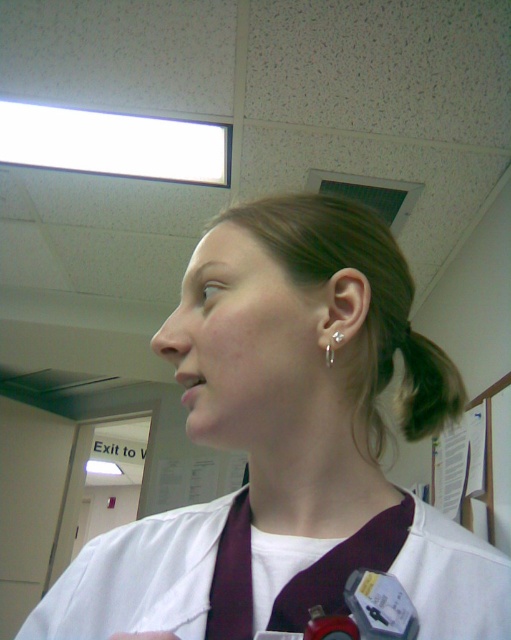
Is white fabric at center behind white matte lab coat at center?

No, white fabric at center is closer to the viewer.

Does white fabric at center have a greater width compared to white matte lab coat at center?

Correct, the width of white fabric at center exceeds that of white matte lab coat at center.

Between point (251, 458) and point (509, 589), which one is positioned behind?

Point (251, 458)

Locate an element on the screen. Image resolution: width=511 pixels, height=640 pixels. white fabric at center is located at coordinates tap(283, 449).

Which is in front, point (420, 412) or point (460, 636)?

Point (460, 636) is in front.

Is dark brown hair at upper right to the left of white matte lab coat at center from the viewer's perspective?

Incorrect, dark brown hair at upper right is not on the left side of white matte lab coat at center.

Locate an element on the screen. This screenshot has height=640, width=511. dark brown hair at upper right is located at coordinates (426, 385).

Is white fabric at center taller than dark brown hair at upper right?

Yes.

Who is more distant from viewer, (334, 545) or (434, 417)?

Point (434, 417)

Where is `white fabric at center`? white fabric at center is located at coordinates (283, 449).